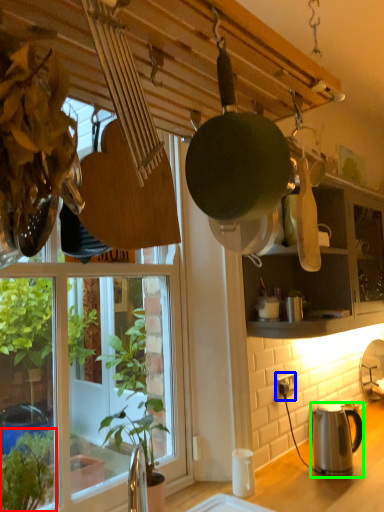
Question: Which is nearer to the houseplant (highlighted by a red box)? power outlet (highlighted by a blue box) or kettle (highlighted by a green box).

Choices:
 (A) power outlet
 (B) kettle

Answer: (B)